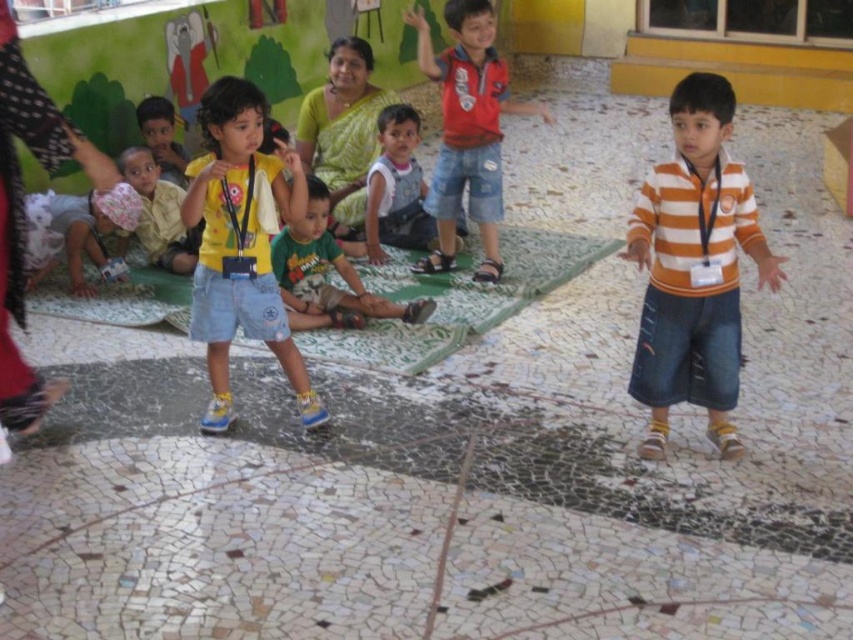
Question: Which point is farther from the camera taking this photo?

Choices:
 (A) click(494, 61)
 (B) click(403, 129)
 (C) click(138, 180)

Answer: (B)

Question: Is orange striped shirt at right wider than red shirt at center?

Choices:
 (A) no
 (B) yes

Answer: (A)

Question: Is light green jersey at center below white cotton dress at lower left?

Choices:
 (A) no
 (B) yes

Answer: (A)

Question: Which object appears closest to the camera in this image?

Choices:
 (A) orange striped shirt at right
 (B) green cotton shirt at center
 (C) white cotton dress at lower left

Answer: (A)

Question: Does yellow cotton shirt at center appear under white cotton dress at lower left?

Choices:
 (A) no
 (B) yes

Answer: (B)

Question: Which of the following is the farthest from the observer?

Choices:
 (A) red shirt at center
 (B) yellow cotton shirt at center
 (C) white cotton dress at lower left

Answer: (A)